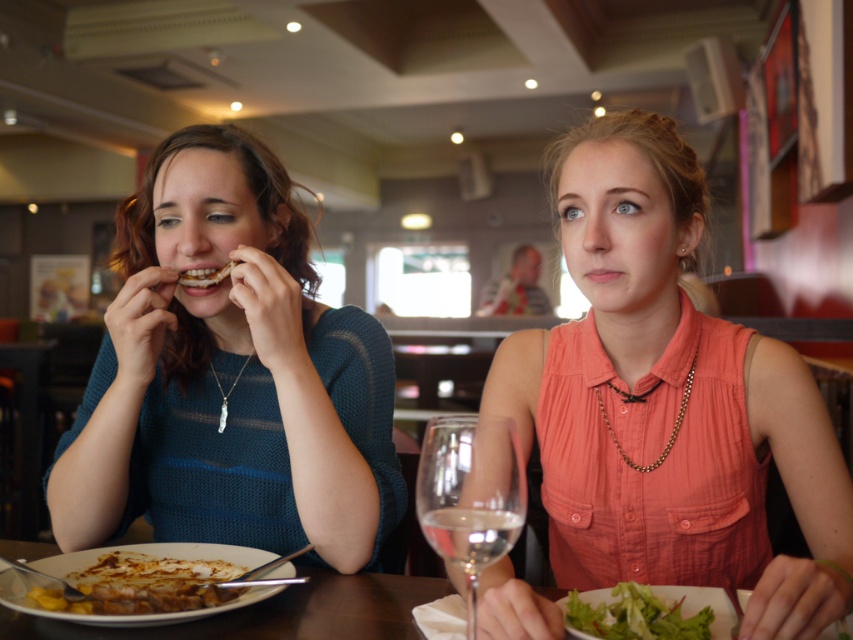
Is point (305, 604) closer to viewer compared to point (213, 564)?

Yes, it is in front of point (213, 564).

Is wooden table at center above golden brown steak at lower left?

Incorrect, wooden table at center is not positioned above golden brown steak at lower left.

Locate an element on the screen. wooden table at center is located at coordinates (279, 612).

The image size is (853, 640). Describe the element at coordinates (671, 429) in the screenshot. I see `gold chain necklace at center` at that location.

Can you confirm if gold chain necklace at center is smaller than white pearl necklace at center?

No, gold chain necklace at center is not smaller than white pearl necklace at center.

Image resolution: width=853 pixels, height=640 pixels. What are the coordinates of `gold chain necklace at center` in the screenshot? It's located at (671, 429).

Find the location of `gold chain necklace at center`. gold chain necklace at center is located at coordinates (671, 429).

Is point (566, 250) positioned after point (151, 577)?

Yes, point (566, 250) is behind point (151, 577).

Can you confirm if matte coral blouse at center is thinner than golden brown steak at lower left?

No, matte coral blouse at center is not thinner than golden brown steak at lower left.

The height and width of the screenshot is (640, 853). Identify the location of matte coral blouse at center. (668, 401).

Identify the location of matte coral blouse at center. The image size is (853, 640). (668, 401).